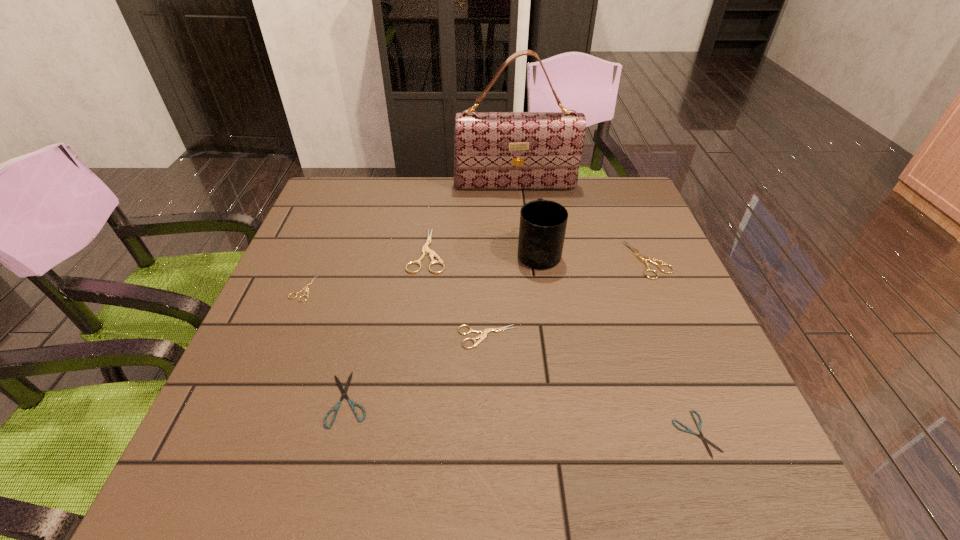
In the image, there is a desktop. At what (x,y) coordinates should I click in order to perform the action: click on vacant space at the far edge. Please return your answer as a coordinate pair (x, y). Looking at the image, I should click on (403, 199).

Locate an element on the screen. This screenshot has width=960, height=540. vacant area at the near edge of the desktop is located at coordinates (628, 463).

Find the location of `free spot at the left edge of the desktop`. free spot at the left edge of the desktop is located at coordinates (336, 227).

Image resolution: width=960 pixels, height=540 pixels. In the image, there is a desktop. What are the coordinates of `vacant space at the right edge` in the screenshot? It's located at point(656,280).

Locate an element on the screen. This screenshot has width=960, height=540. vacant region at the far right corner of the desktop is located at coordinates (611, 200).

At what (x,y) coordinates should I click in order to perform the action: click on vacant area that lies between the sixth shortest object and the shortest object. Please return your answer as a coordinate pair (x, y). The height and width of the screenshot is (540, 960). Looking at the image, I should click on (562, 342).

Identify the location of free spot between the leftmost object and the farthest object. This screenshot has width=960, height=540. (409, 237).

Locate an element on the screen. vacant area that lies between the tallest shears and the smaller black shears is located at coordinates (562, 342).

Image resolution: width=960 pixels, height=540 pixels. I want to click on vacant area that lies between the smallest beige shears and the third smallest beige shears, so click(475, 274).

This screenshot has width=960, height=540. What are the coordinates of `vacant space in between the shortest object and the black mug` in the screenshot? It's located at pos(617,343).